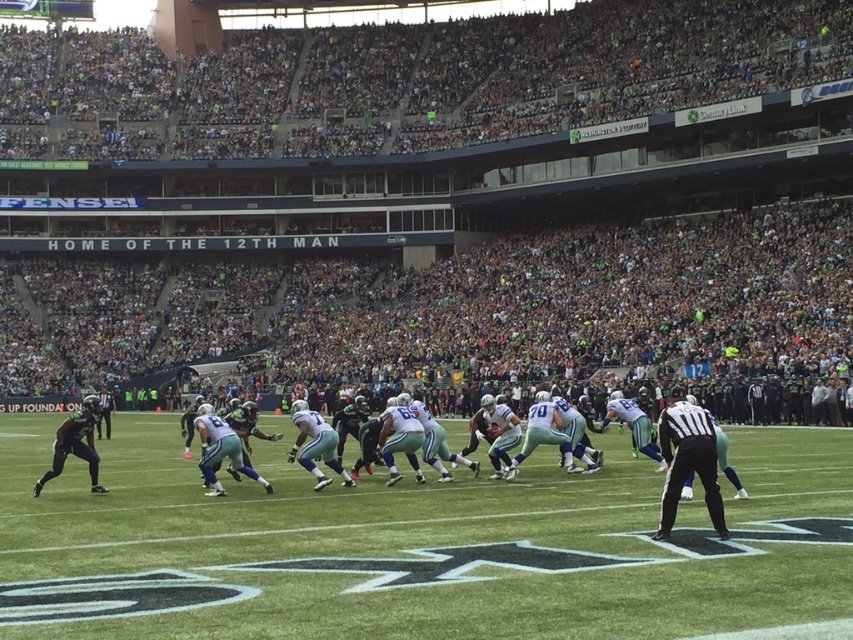
Question: Can you confirm if white turf at center is wider than black uniform at right?

Choices:
 (A) no
 (B) yes

Answer: (B)

Question: Among these objects, which one is nearest to the camera?

Choices:
 (A) white turf at center
 (B) black uniform at right

Answer: (A)

Question: Is white turf at center wider than black uniform at right?

Choices:
 (A) no
 (B) yes

Answer: (B)

Question: Is white turf at center closer to camera compared to black uniform at right?

Choices:
 (A) no
 (B) yes

Answer: (B)